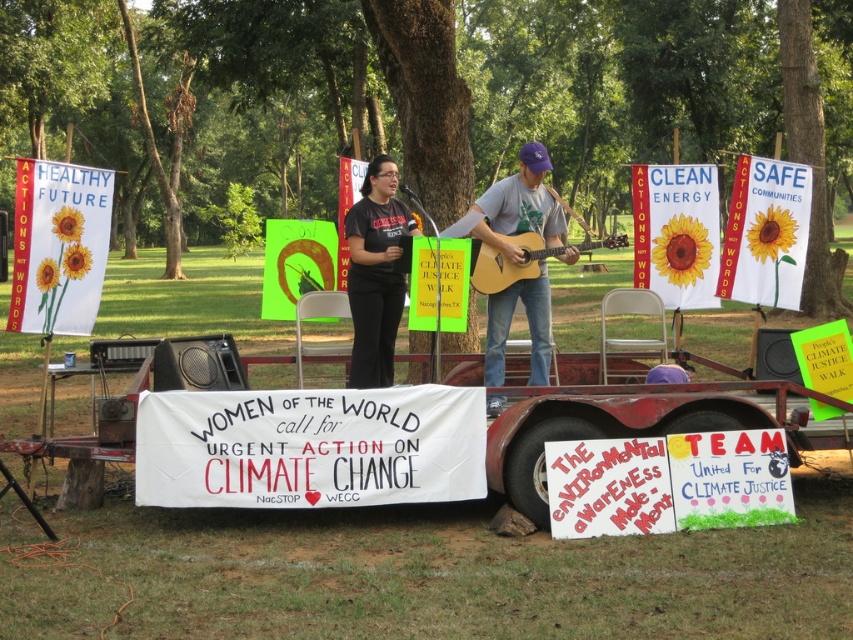
Is matte gray t-shirt at center to the right of black t-shirt at center from the viewer's perspective?

Correct, you'll find matte gray t-shirt at center to the right of black t-shirt at center.

Is point (508, 310) positioned before point (368, 262)?

No, (508, 310) is further to viewer.

Locate an element on the screen. The image size is (853, 640). matte gray t-shirt at center is located at coordinates (515, 209).

Can you confirm if black t-shirt at center is wider than acoustic wood guitar at center?

Incorrect, black t-shirt at center's width does not surpass acoustic wood guitar at center's.

Who is positioned more to the right, black t-shirt at center or acoustic wood guitar at center?

From the viewer's perspective, acoustic wood guitar at center appears more on the right side.

I want to click on black t-shirt at center, so click(375, 273).

Measure the distance between matte gray t-shirt at center and acoustic wood guitar at center.

The distance of matte gray t-shirt at center from acoustic wood guitar at center is 21.64 inches.

Who is higher up, matte gray t-shirt at center or acoustic wood guitar at center?

acoustic wood guitar at center is above.

Between point (495, 228) and point (480, 253), which one is positioned behind?

Point (495, 228)

The height and width of the screenshot is (640, 853). Identify the location of matte gray t-shirt at center. (515, 209).